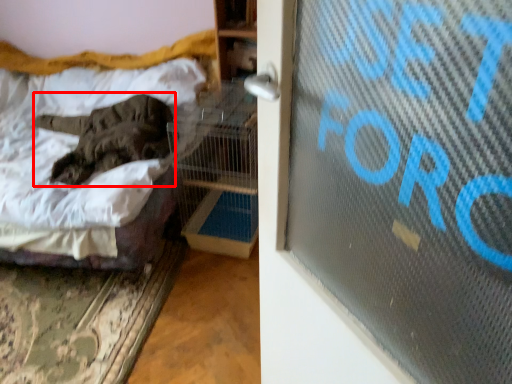
Question: From the image's perspective, considering the relative positions of animal (annotated by the red box) and bed in the image provided, where is animal (annotated by the red box) located with respect to the staircase?

Choices:
 (A) above
 (B) below

Answer: (A)